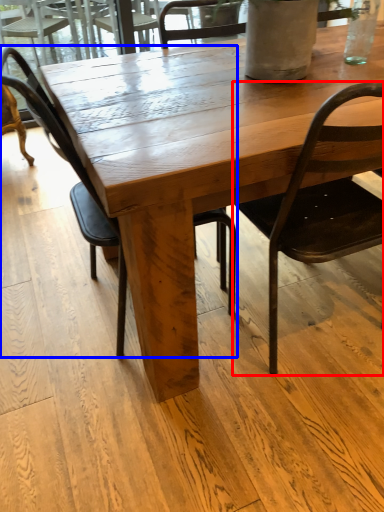
Question: Which object appears farthest to the camera in this image, chair (highlighted by a red box) or chair (highlighted by a blue box)?

Choices:
 (A) chair
 (B) chair

Answer: (B)